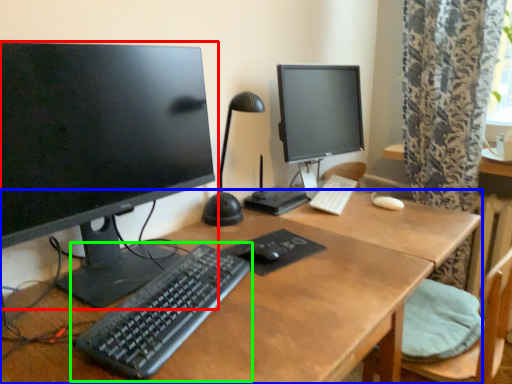
Question: Considering the real-world distances, which object is closest to computer monitor (highlighted by a red box)? desk (highlighted by a blue box) or computer keyboard (highlighted by a green box).

Choices:
 (A) desk
 (B) computer keyboard

Answer: (B)